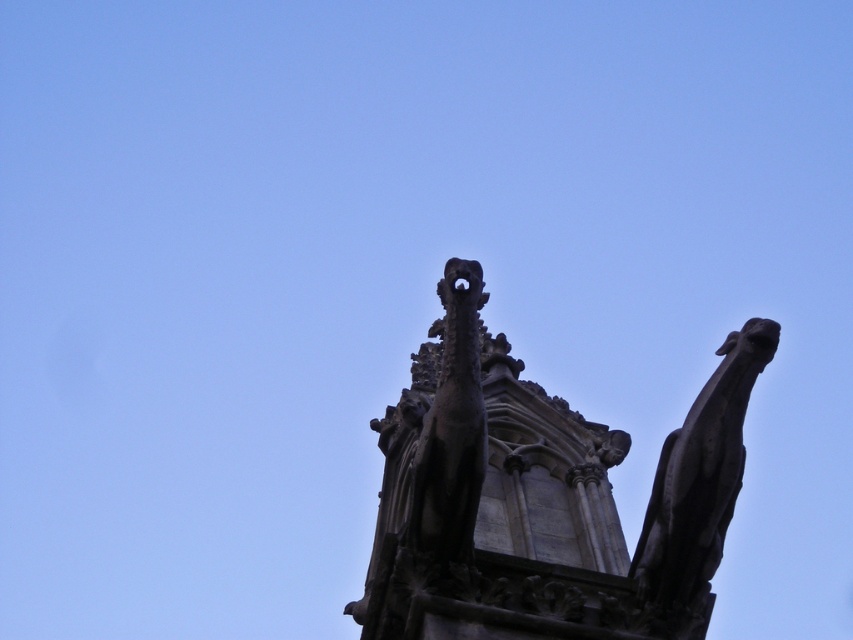
You are standing at the base of the gothic structure and looking up. There is a dark gray stone gargoyle at upper center represented by point (543, 497). Which direction should you turn to face the gargoyle?

The dark gray stone gargoyle at upper center is located at coordinate point (543, 497), which is directly in front of you at the upper center position. Therefore, you don not need to turn and can face straight ahead to look at it.

You are an architect examining the gothic structure. You need to locate the dark gray stone gargoyle at upper center. What are its coordinates?

The dark gray stone gargoyle at upper center is located at coordinates point (543, 497).